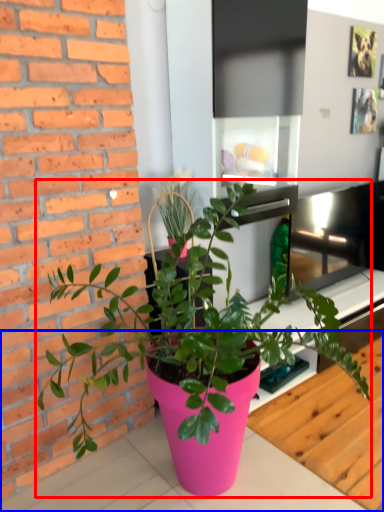
Question: Among these objects, which one is farthest to the camera, houseplant (highlighted by a red box) or table (highlighted by a blue box)?

Choices:
 (A) houseplant
 (B) table

Answer: (B)